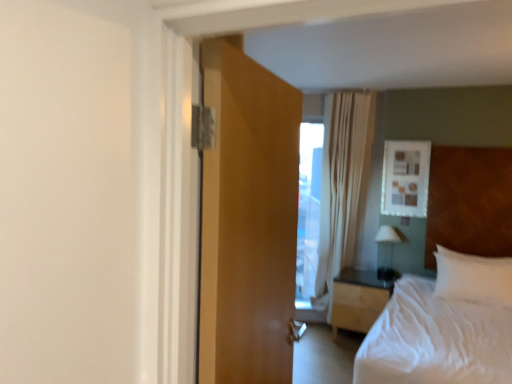
Question: Considering the positions of light wood/wooden nightstand at center and white soft pillow at right in the image, is light wood/wooden nightstand at center taller or shorter than white soft pillow at right?

Choices:
 (A) short
 (B) tall

Answer: (B)

Question: Is light wood/wooden nightstand at center to the left or to the right of white soft pillow at right in the image?

Choices:
 (A) right
 (B) left

Answer: (B)

Question: Which object is positioned farthest from the white soft bed at right?

Choices:
 (A) white soft pillow at right
 (B) white glossy lamp at right
 (C) wooden door at center
 (D) white sheer curtain at upper center
 (E) light wood/wooden nightstand at center

Answer: (D)

Question: Which is farther from the light wood/wooden nightstand at center?

Choices:
 (A) wooden door at center
 (B) white soft bed at right
 (C) white glossy lamp at right
 (D) white sheer curtain at upper center
 (E) white soft pillow at right

Answer: (A)